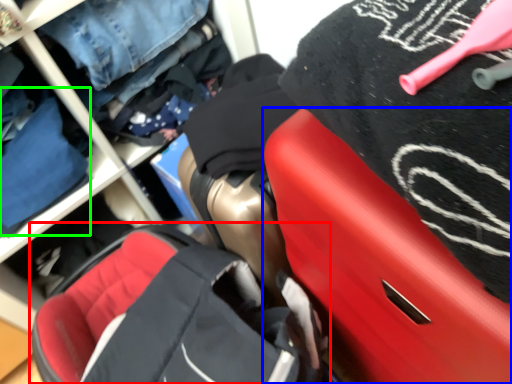
Question: Estimate the real-world distances between objects in this image. Which object is closer to baby carriage (highlighted by a red box), luggage (highlighted by a blue box) or clothing (highlighted by a green box)?

Choices:
 (A) luggage
 (B) clothing

Answer: (A)